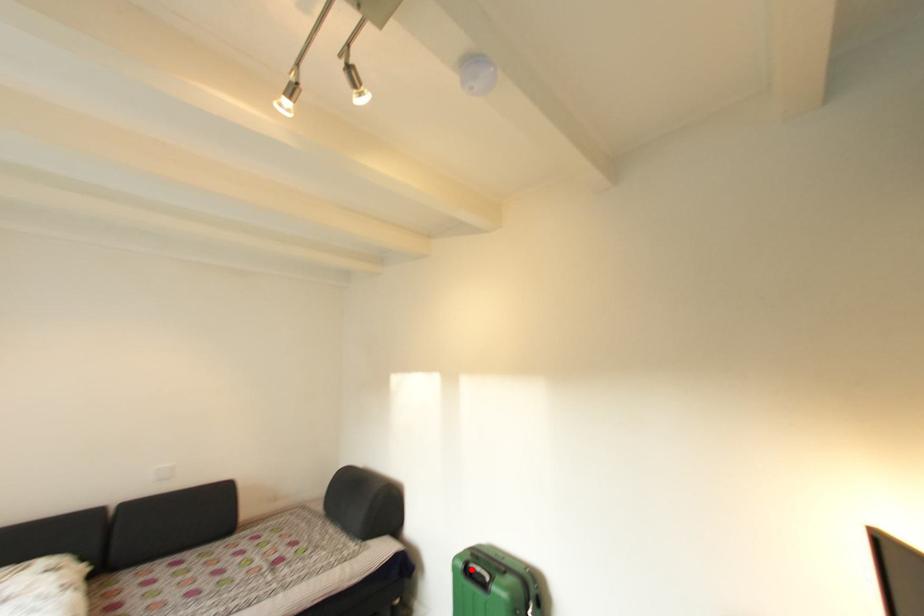
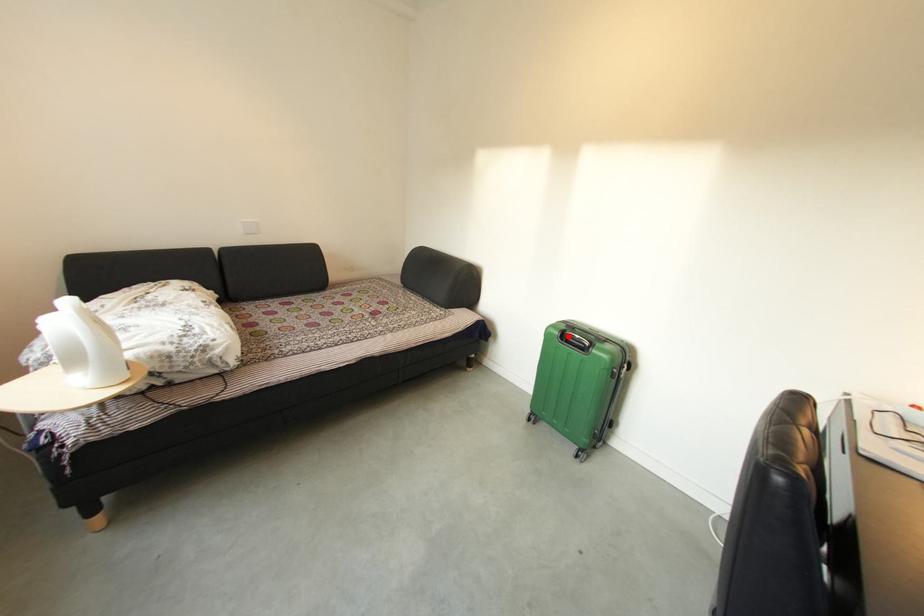
I am providing you with two images of the same scene from different viewpoints. A red point is marked on the first image and another point is marked on the second image. Is the red point in image1 aligned with the point shown in image2?

Yes